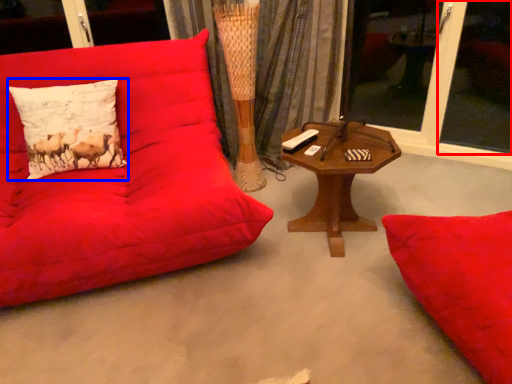
Question: Which object is further to the camera taking this photo, window screen (highlighted by a red box) or pillow (highlighted by a blue box)?

Choices:
 (A) window screen
 (B) pillow

Answer: (A)